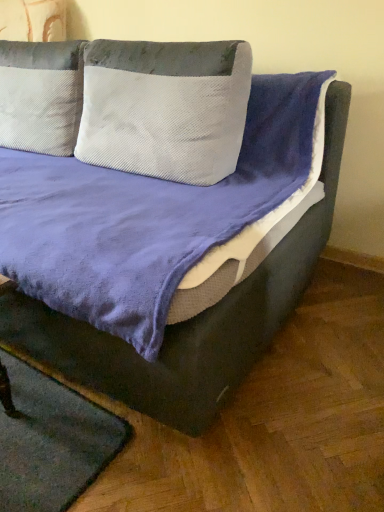
You are a GUI agent. You are given a task and a screenshot of the screen. Output one action in this format:
    pyautogui.click(x=<x>, y=<y>)
    Task: Click on the vacant space to the right of green felt mat at lower left
    The width and height of the screenshot is (384, 512).
    Given the screenshot: What is the action you would take?
    pyautogui.click(x=166, y=458)